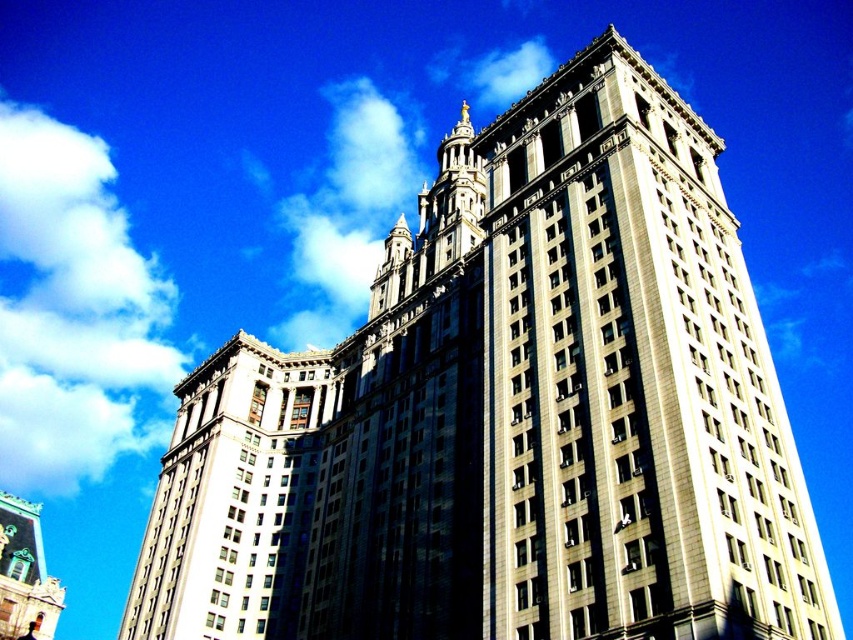
Can you confirm if white marble tower at center is wider than green copper dome at lower left?

No.

Is point (189, 426) closer to viewer compared to point (30, 579)?

Yes.

Where is `white marble tower at center`? white marble tower at center is located at coordinates (233, 499).

Who is positioned more to the right, white fluffy cloud at upper left or white marble tower at center?

white marble tower at center is more to the right.

I want to click on white fluffy cloud at upper left, so click(x=73, y=312).

What are the coordinates of `white fluffy cloud at upper left` in the screenshot? It's located at (73, 312).

How much distance is there between white fluffy cloud at upper left and green copper dome at lower left?

white fluffy cloud at upper left is 77.54 meters away from green copper dome at lower left.

Who is lower down, white fluffy cloud at upper left or green copper dome at lower left?

green copper dome at lower left

Between point (21, 214) and point (6, 611), which one is positioned behind?

The point (21, 214) is behind.

Image resolution: width=853 pixels, height=640 pixels. In order to click on white fluffy cloud at upper left in this screenshot , I will do `click(73, 312)`.